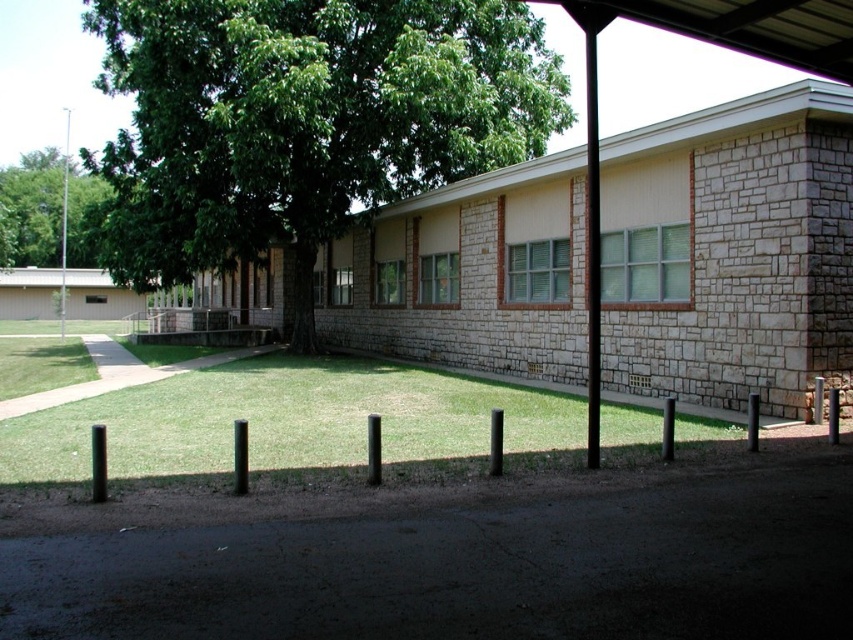
Between black metal awning at upper center and green leafy tree at upper left, which one has less height?

Standing shorter between the two is green leafy tree at upper left.

Can you confirm if black metal awning at upper center is smaller than green leafy tree at upper left?

Yes, black metal awning at upper center is smaller than green leafy tree at upper left.

The width and height of the screenshot is (853, 640). What are the coordinates of `black metal awning at upper center` in the screenshot? It's located at (741, 26).

What are the coordinates of `black metal awning at upper center` in the screenshot? It's located at (741, 26).

Who is shorter, green leafy tree at center or black metal awning at upper center?

green leafy tree at center

Is green leafy tree at center thinner than black metal awning at upper center?

In fact, green leafy tree at center might be wider than black metal awning at upper center.

What do you see at coordinates (303, 122) in the screenshot? I see `green leafy tree at center` at bounding box center [303, 122].

Find the location of `green leafy tree at center`. green leafy tree at center is located at coordinates (303, 122).

Does green grass at center appear on the left side of black metal awning at upper center?

Indeed, green grass at center is positioned on the left side of black metal awning at upper center.

Is the position of green grass at center more distant than that of black metal awning at upper center?

Yes, green grass at center is behind black metal awning at upper center.

Does point (265, 428) come behind point (627, 8)?

Yes, it is behind point (627, 8).

You are a GUI agent. You are given a task and a screenshot of the screen. Output one action in this format:
    pyautogui.click(x=<x>, y=<y>)
    Task: Click on the green grass at center
    Image resolution: width=853 pixels, height=640 pixels.
    Given the screenshot: What is the action you would take?
    pos(289,422)